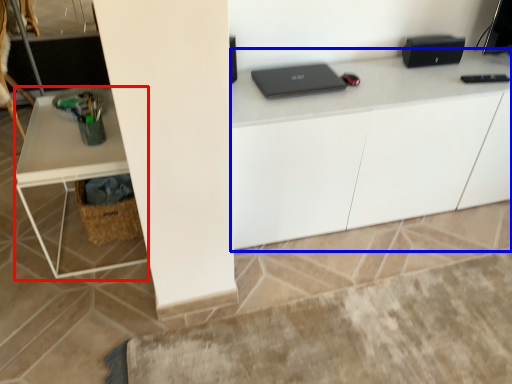
Question: Which of the following is the closest to the observer, computer desk (highlighted by a red box) or computer desk (highlighted by a blue box)?

Choices:
 (A) computer desk
 (B) computer desk

Answer: (A)